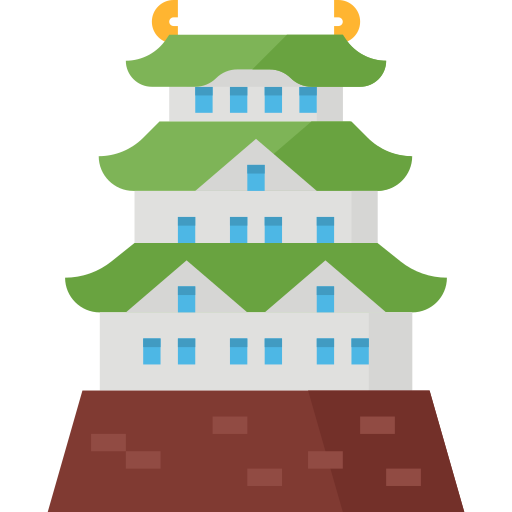
Identify the location of 2nd floor windows. Image resolution: width=512 pixels, height=512 pixels. (254, 170), (188, 231), (240, 233), (276, 232), (324, 231).